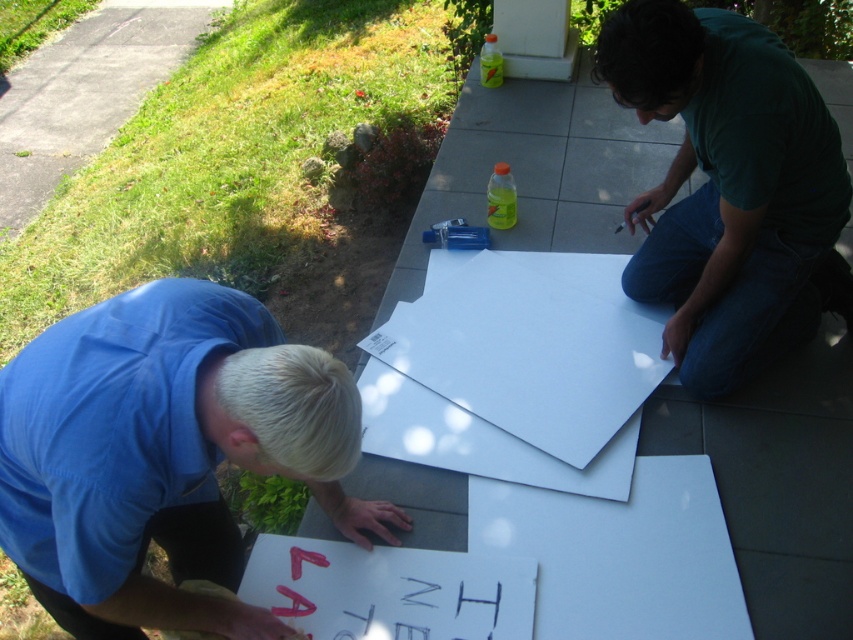
Question: Is white paper at lower left bigger than dark green t-shirt at upper right?

Choices:
 (A) no
 (B) yes

Answer: (A)

Question: Estimate the real-world distances between objects in this image. Which object is closer to the dark green t-shirt at upper right?

Choices:
 (A) white matte paper at center
 (B) white paper at lower left

Answer: (A)

Question: Does white paper at lower left come behind dark green t-shirt at upper right?

Choices:
 (A) yes
 (B) no

Answer: (B)

Question: Which of the following is the closest to the observer?

Choices:
 (A) (482, 250)
 (B) (189, 570)
 (C) (793, 273)

Answer: (B)

Question: Which point is closer to the camera?

Choices:
 (A) (642, 280)
 (B) (460, 330)
 (C) (32, 467)

Answer: (C)

Question: Can you confirm if dark green t-shirt at upper right is positioned above white matte paper at center?

Choices:
 (A) no
 (B) yes

Answer: (B)